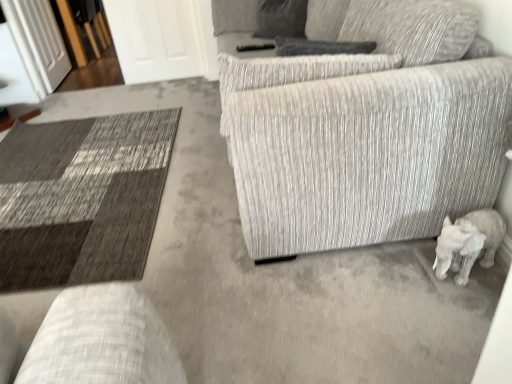
Question: Is textured gray couch at center not close to transparent glass door at upper left, arranged as the 2th glass door when viewed from the right?

Choices:
 (A) no
 (B) yes

Answer: (B)

Question: Does textured gray couch at center have a smaller size compared to transparent glass door at upper left, placed as the first glass door when sorted from left to right?

Choices:
 (A) no
 (B) yes

Answer: (A)

Question: From a real-world perspective, is textured gray couch at center physically above transparent glass door at upper left, arranged as the 2th glass door when viewed from the right?

Choices:
 (A) no
 (B) yes

Answer: (B)

Question: Does textured gray couch at center have a lesser height compared to transparent glass door at upper left, placed as the first glass door when sorted from left to right?

Choices:
 (A) yes
 (B) no

Answer: (B)

Question: Is textured gray couch at center wider than transparent glass door at upper left, placed as the first glass door when sorted from left to right?

Choices:
 (A) yes
 (B) no

Answer: (A)

Question: Would you say textured gray couch at center is outside transparent glass door at upper left, placed as the first glass door when sorted from left to right?

Choices:
 (A) no
 (B) yes

Answer: (B)

Question: Is the depth of textured gray couch at center greater than that of gray fabric pillow at upper center?

Choices:
 (A) yes
 (B) no

Answer: (B)

Question: Is textured gray couch at center facing towards gray fabric pillow at upper center?

Choices:
 (A) no
 (B) yes

Answer: (B)

Question: From the image's perspective, is textured gray couch at center above gray fabric pillow at upper center?

Choices:
 (A) yes
 (B) no

Answer: (B)

Question: Does textured gray couch at center have a greater width compared to gray fabric pillow at upper center?

Choices:
 (A) no
 (B) yes

Answer: (B)

Question: Can you confirm if textured gray couch at center is bigger than gray fabric pillow at upper center?

Choices:
 (A) no
 (B) yes

Answer: (B)

Question: From a real-world perspective, is textured gray couch at center positioned under gray fabric pillow at upper center based on gravity?

Choices:
 (A) no
 (B) yes

Answer: (B)

Question: Is white matte elephant at lower right facing away from gray fabric pillow at upper center?

Choices:
 (A) yes
 (B) no

Answer: (B)